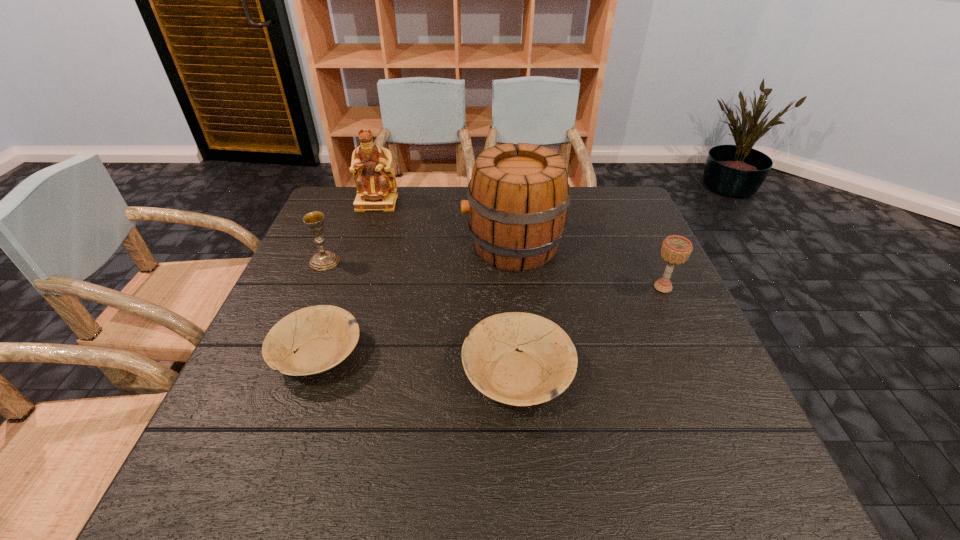
I want to click on free space that is in between the farthest object and the shortest object, so click(348, 279).

Locate an element on the screen. free space between the nearer chalice and the cider is located at coordinates (588, 267).

The width and height of the screenshot is (960, 540). I want to click on empty space that is in between the left chalice and the cider, so click(419, 254).

Identify the location of vacant point located between the shorter bowl and the second shortest object. (418, 364).

Locate an element on the screen. vacant space that's between the cider and the farther chalice is located at coordinates (419, 254).

This screenshot has width=960, height=540. I want to click on blank region between the left chalice and the taller bowl, so click(x=420, y=318).

You are a GUI agent. You are given a task and a screenshot of the screen. Output one action in this format:
    pyautogui.click(x=<x>, y=<y>)
    Task: Click on the free space between the taller bowl and the figurine
    The height and width of the screenshot is (540, 960).
    Given the screenshot: What is the action you would take?
    [x=447, y=288]

I want to click on object that can be found as the fourth closest to the shortest object, so click(375, 181).

The height and width of the screenshot is (540, 960). Identify the location of the second closest object to the farthest object. (518, 198).

Locate an element on the screen. free space that satisfies the following two spatial constraints: 1. on the front-facing side of the nearer chalice; 2. on the right side of the farthest object is located at coordinates (348, 287).